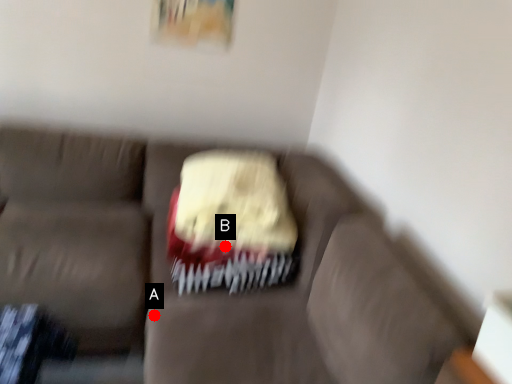
Question: Two points are circled on the image, labeled by A and B beside each circle. Among these points, which one is nearest to the camera?

Choices:
 (A) A is closer
 (B) B is closer

Answer: (A)